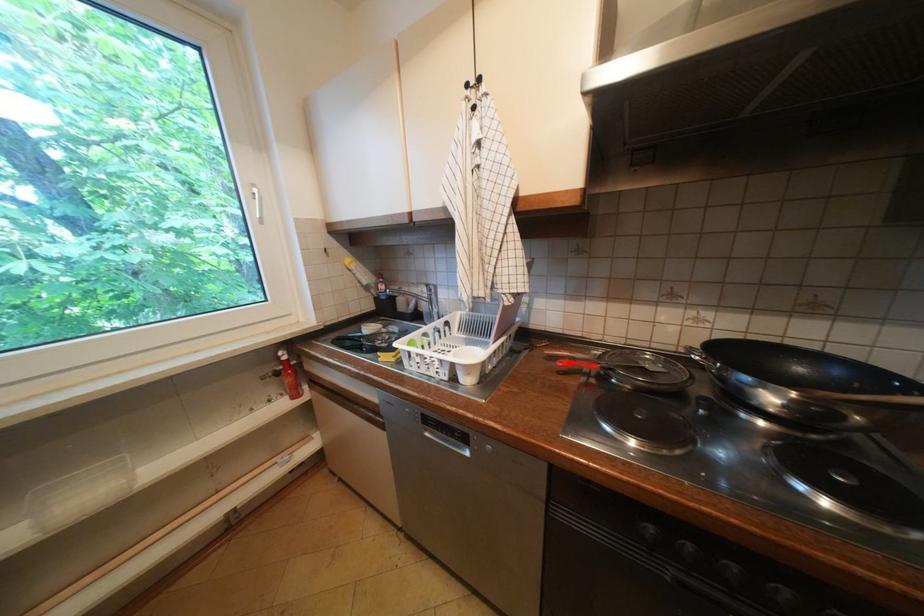
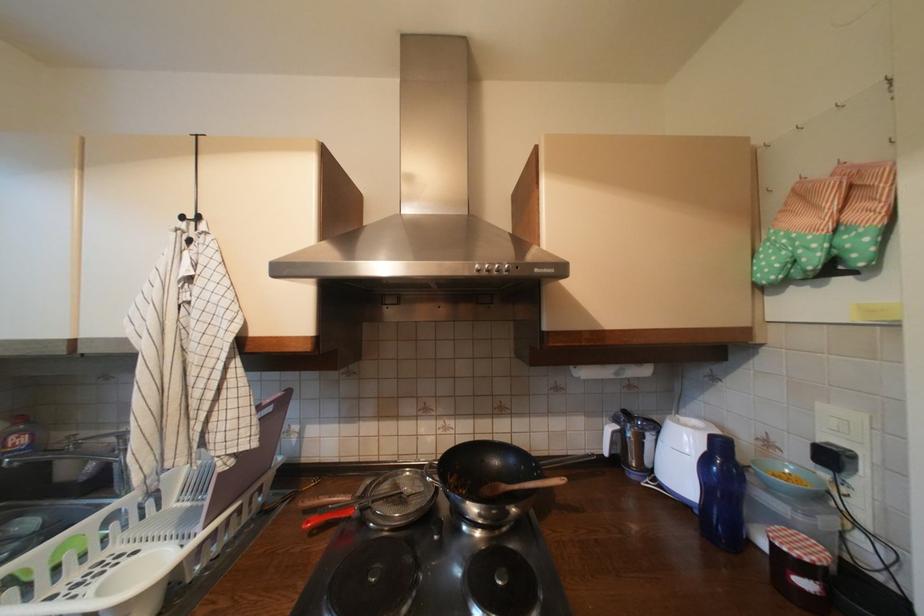
Find the pixel in the second image that matches the highlighted location in the first image.

(317, 524)